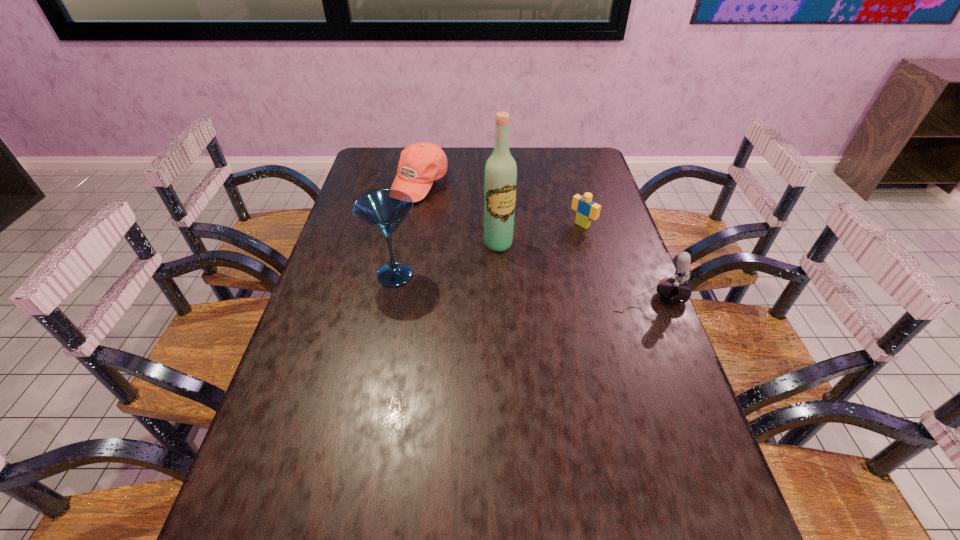
Locate an element on the screen. The image size is (960, 540). object that is the second closest to the wine bottle is located at coordinates (587, 210).

I want to click on vacant space that satisfies the following two spatial constraints: 1. on the front side of the baseball cap; 2. on the right side of the Lego, so point(413,225).

The height and width of the screenshot is (540, 960). Identify the location of vacant point that satisfies the following two spatial constraints: 1. on the front side of the microphone; 2. on the left side of the second tallest object. pos(390,299).

The height and width of the screenshot is (540, 960). In order to click on vacant position in the image that satisfies the following two spatial constraints: 1. on the front side of the farthest object; 2. on the left side of the microphone in this screenshot , I will do `click(399, 299)`.